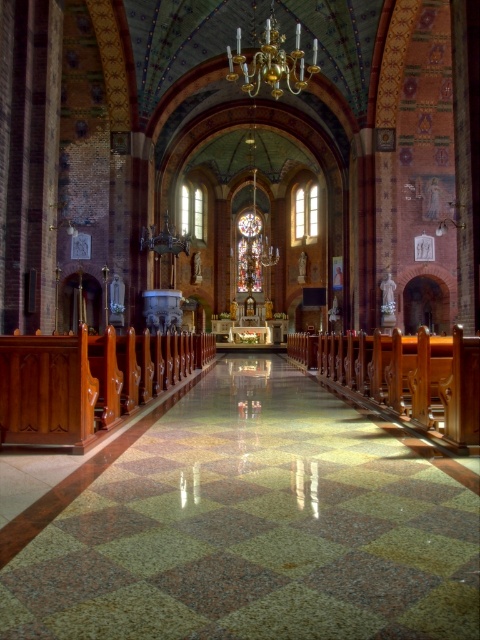
You are a tour guide leading a group through this grand church. You want to inform your visitors about the distance between the green polished stone aisle at center and the stained glass at center. How far apart are these two features?

The distance between the green polished stone aisle at center and the stained glass at center is 182.99 feet.

You are standing in the nave of the church looking towards the altar. You notice two windows at the center of the image. Which one is more to the left, the stained glass at center or the clear glass window at center?

The stained glass at center is positioned on the left side of clear glass window at center, so the stained glass at center is more to the left.

You are standing in the grand church and want to move from the nave towards the altar. There are two points marked in the scene, point 1 at coordinates point (x=249, y=259) and point 2 at coordinates point (x=297, y=193). Which point is closer to your current position?

Point 1 at coordinates point (x=249, y=259) is closer to your current position because it is further to the viewer than point 2 at coordinates point (x=297, y=193).